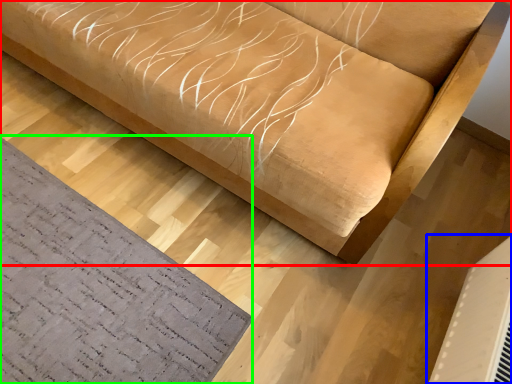
Question: Which object is the farthest from furniture (highlighted by a red box)? Choose among these: air conditioning (highlighted by a blue box) or mat (highlighted by a green box).

Choices:
 (A) air conditioning
 (B) mat

Answer: (A)